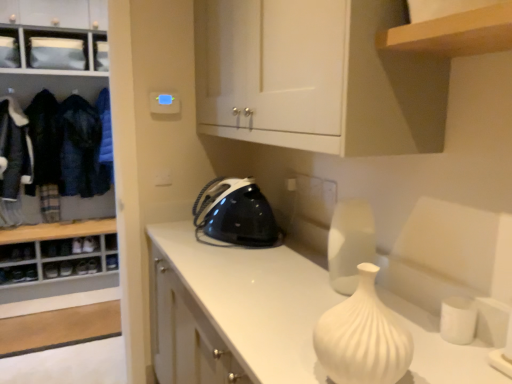
The width and height of the screenshot is (512, 384). Describe the element at coordinates (234, 214) in the screenshot. I see `black glossy iron at center` at that location.

Find the location of a particular element. The image size is (512, 384). dark blue denim jacket at left, the 4th clothing from the right is located at coordinates (14, 149).

Where is `white wood cabinet at left, acting as the 2th cabinetry starting from the front`? This screenshot has width=512, height=384. white wood cabinet at left, acting as the 2th cabinetry starting from the front is located at coordinates (56, 68).

The image size is (512, 384). What do you see at coordinates (350, 243) in the screenshot?
I see `white matte vase at center` at bounding box center [350, 243].

You are a GUI agent. You are given a task and a screenshot of the screen. Output one action in this format:
    pyautogui.click(x=<x>, y=<y>)
    Task: Click on the white matte vase at center
    This screenshot has width=512, height=384.
    Given the screenshot: What is the action you would take?
    pyautogui.click(x=362, y=337)

Locate an element on the screen. The image size is (512, 384). black glossy iron at center is located at coordinates (234, 214).

From a real-world perspective, is dark blue denim jacket at left, the 4th clothing from the right, over blue fabric at left, which ranks as the 1th clothing in right-to-left order?

No.

Which is more to the left, dark blue denim jacket at left, the 4th clothing from the right, or blue fabric at left, the fourth clothing from the left?

From the viewer's perspective, dark blue denim jacket at left, the 4th clothing from the right, appears more on the left side.

How distant is dark blue denim jacket at left, which is the 1th clothing from left to right, from blue fabric at left, which ranks as the 1th clothing in right-to-left order?

dark blue denim jacket at left, which is the 1th clothing from left to right, is 24.60 inches from blue fabric at left, which ranks as the 1th clothing in right-to-left order.

Between point (3, 181) and point (106, 132), which one is positioned behind?

The point (106, 132) is more distant.

Is point (259, 46) closer or farther from the camera than point (109, 133)?

Point (259, 46).

Is white matte cabinet at upper center, the first cabinetry from the front, directly adjacent to blue fabric at left, which ranks as the 1th clothing in right-to-left order?

No.

Between white matte cabinet at upper center, which is the 2th cabinetry from back to front, and blue fabric at left, the fourth clothing from the left, which one has smaller size?

With smaller size is blue fabric at left, the fourth clothing from the left.

The width and height of the screenshot is (512, 384). Find the location of `glass vase on the right of white glossy countertop at center`. glass vase on the right of white glossy countertop at center is located at coordinates (362, 337).

Is white glossy countertop at center bigger or smaller than white matte vase at center?

Considering their sizes, white glossy countertop at center takes up more space than white matte vase at center.

From the image's perspective, is white glossy countertop at center located above white matte vase at center?

No, from the image's perspective, white glossy countertop at center is not above white matte vase at center.

Considering the sizes of objects white glossy countertop at center and white matte vase at center in the image provided, who is taller, white glossy countertop at center or white matte vase at center?

With more height is white glossy countertop at center.

Can black glossy iron at center be found inside blue fabric at left, the fourth clothing from the left?

No, black glossy iron at center is not inside blue fabric at left, the fourth clothing from the left.

Which is behind, blue fabric at left, which ranks as the 1th clothing in right-to-left order, or black glossy iron at center?

blue fabric at left, which ranks as the 1th clothing in right-to-left order, is behind.

Who is shorter, blue fabric at left, the fourth clothing from the left, or black glossy iron at center?

Standing shorter between the two is black glossy iron at center.

From the picture: Who is smaller, blue fabric at left, the fourth clothing from the left, or black glossy iron at center?

With smaller size is blue fabric at left, the fourth clothing from the left.

Considering the positions of point (34, 124) and point (295, 59), is point (34, 124) closer or farther from the camera than point (295, 59)?

Clearly, point (34, 124) is more distant from the camera than point (295, 59).

Is white matte cabinet at upper center, the first cabinetry from the front, at the back of dark blue woolen jacket at left, the third clothing when ordered from right to left?

No, dark blue woolen jacket at left, the third clothing when ordered from right to left, is not facing the opposite direction of white matte cabinet at upper center, the first cabinetry from the front.

Can you confirm if dark blue woolen jacket at left, the third clothing when ordered from right to left, is wider than white matte cabinet at upper center, arranged as the 1th cabinetry when viewed from the right?

No.

From a real-world perspective, which object stands above the other?

white matte cabinet at upper center, the first cabinetry from the front.

Can you tell me how much white wood cabinet at left, placed as the 1th cabinetry when sorted from back to front, and white matte vase at center differ in facing direction?

The angular difference between white wood cabinet at left, placed as the 1th cabinetry when sorted from back to front, and white matte vase at center is 90.9 degrees.

Does white wood cabinet at left, acting as the 2th cabinetry starting from the front, have a lesser width compared to white matte vase at center?

Incorrect, the width of white wood cabinet at left, acting as the 2th cabinetry starting from the front, is not less than that of white matte vase at center.

Is white wood cabinet at left, which ranks as the 2th cabinetry in right-to-left order, to the left of white matte vase at center from the viewer's perspective?

Yes.

This screenshot has width=512, height=384. What are the coordinates of `vase in front of the white wood cabinet at left, which ranks as the 2th cabinetry in right-to-left order` in the screenshot? It's located at coord(350,243).

Which object is more forward, white matte vase at center or white glossy countertop at center?

white glossy countertop at center is more forward.

Which is in front, point (355, 243) or point (480, 359)?

Positioned in front is point (480, 359).

Looking at the image, does white matte vase at center seem bigger or smaller compared to white glossy countertop at center?

Considering their sizes, white matte vase at center takes up less space than white glossy countertop at center.

Considering the relative sizes of white matte vase at center and white glossy countertop at center in the image provided, is white matte vase at center thinner than white glossy countertop at center?

Yes, white matte vase at center is thinner than white glossy countertop at center.

From a real-world perspective, which clothing is the 1st one underneath the blue fabric at left, which ranks as the 1th clothing in right-to-left order? Please provide its 2D coordinates.

[(14, 149)]

What are the coordinates of `clothing that is the 4th one when counting backward from the white matte cabinet at upper center, which appears as the 2th cabinetry when viewed from the left` in the screenshot? It's located at (105, 131).

Considering their positions, is dark blue denim jacket at left, the 4th clothing from the right, positioned further to white glossy countertop at center than dark blue woolen jacket at left, which ranks as the 2th clothing in left-to-right order?

Among the two, dark blue denim jacket at left, the 4th clothing from the right, is located further to white glossy countertop at center.

When comparing their distances from blue fabric at left, the fourth clothing from the left, does dark blue woolen jacket at left, which ranks as the 2th clothing in left-to-right order, or white wood cabinet at left, which ranks as the 2th cabinetry in right-to-left order, seem closer?

dark blue woolen jacket at left, which ranks as the 2th clothing in left-to-right order.

Which object lies further to the anchor point dark blue woolen jacket at left, which ranks as the 2th clothing in left-to-right order, white matte vase at center or black glossy iron at center?

Among the two, white matte vase at center is located further to dark blue woolen jacket at left, which ranks as the 2th clothing in left-to-right order.

Looking at the image, which one is located closer to white matte cabinet at upper center, which appears as the 2th cabinetry when viewed from the left, dark blue woolen jacket at left, which ranks as the 2th clothing in left-to-right order, or white matte vase at center?

Among the two, white matte vase at center is located nearer to white matte cabinet at upper center, which appears as the 2th cabinetry when viewed from the left.

When comparing their distances from denim jacket at left, which is the second clothing from right to left, does white matte vase at center or white matte cabinet at upper center, which appears as the 2th cabinetry when viewed from the left, seem closer?

white matte cabinet at upper center, which appears as the 2th cabinetry when viewed from the left, is positioned closer to the anchor denim jacket at left, which is the second clothing from right to left.

Estimate the real-world distances between objects in this image. Which object is further from denim jacket at left, which is the second clothing from right to left, black glossy iron at center or dark blue denim jacket at left, the 4th clothing from the right?

Based on the image, black glossy iron at center appears to be further to denim jacket at left, which is the second clothing from right to left.

When comparing their distances from white matte cabinet at upper center, which is the 2th cabinetry from back to front, does white matte vase at center or denim jacket at left, arranged as the 3th clothing when viewed from the left, seem closer?

white matte vase at center.

Based on the photo, considering their positions, is dark blue woolen jacket at left, the third clothing when ordered from right to left, positioned closer to blue fabric at left, the fourth clothing from the left, than white matte vase at center?

The object closer to blue fabric at left, the fourth clothing from the left, is dark blue woolen jacket at left, the third clothing when ordered from right to left.

Where is `home appliance between white matte vase at center and denim jacket at left, arranged as the 3th clothing when viewed from the left, in the front-back direction`? This screenshot has height=384, width=512. home appliance between white matte vase at center and denim jacket at left, arranged as the 3th clothing when viewed from the left, in the front-back direction is located at coordinates (234, 214).

Find the location of `vase positioned between white glossy countertop at center and denim jacket at left, arranged as the 3th clothing when viewed from the left, from near to far`. vase positioned between white glossy countertop at center and denim jacket at left, arranged as the 3th clothing when viewed from the left, from near to far is located at coordinates (350, 243).

This screenshot has width=512, height=384. What are the coordinates of `cabinetry situated between dark blue denim jacket at left, which is the 1th clothing from left to right, and black glossy iron at center from left to right` in the screenshot? It's located at (56, 68).

Find the location of `home appliance between white glossy countertop at center and denim jacket at left, which is the second clothing from right to left, in the front-back direction`. home appliance between white glossy countertop at center and denim jacket at left, which is the second clothing from right to left, in the front-back direction is located at coordinates (234, 214).